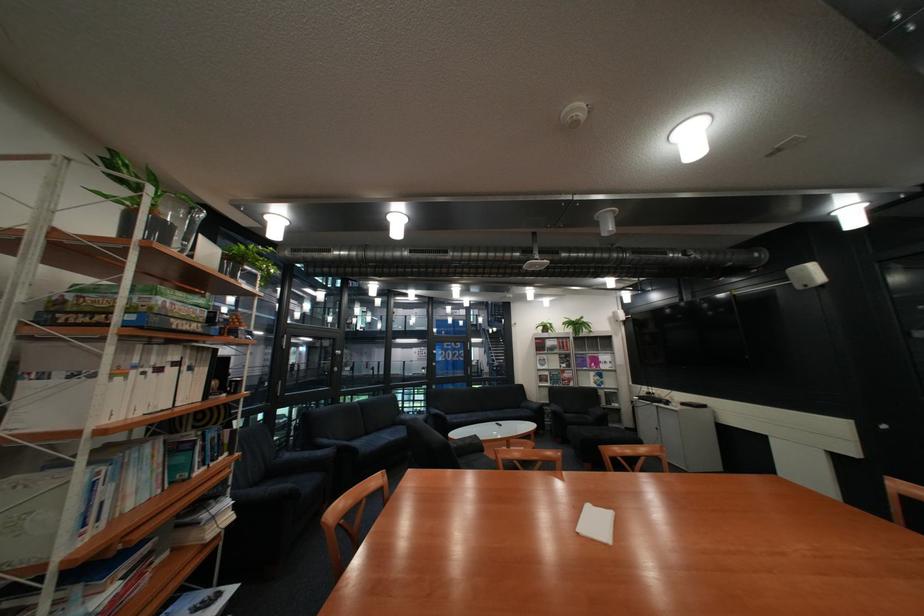
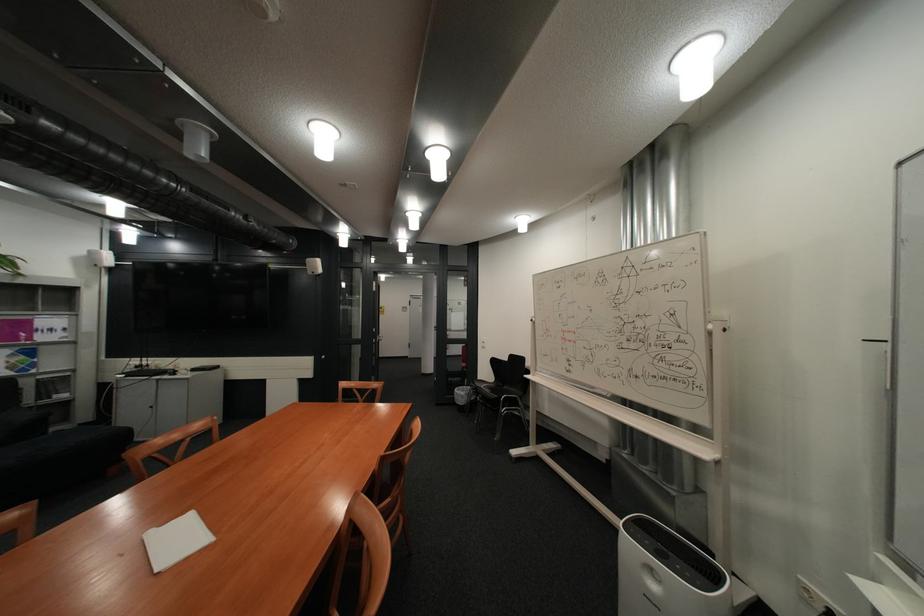
Find the pixel in the second image that matches pixel 626 424 in the first image.

(68, 430)